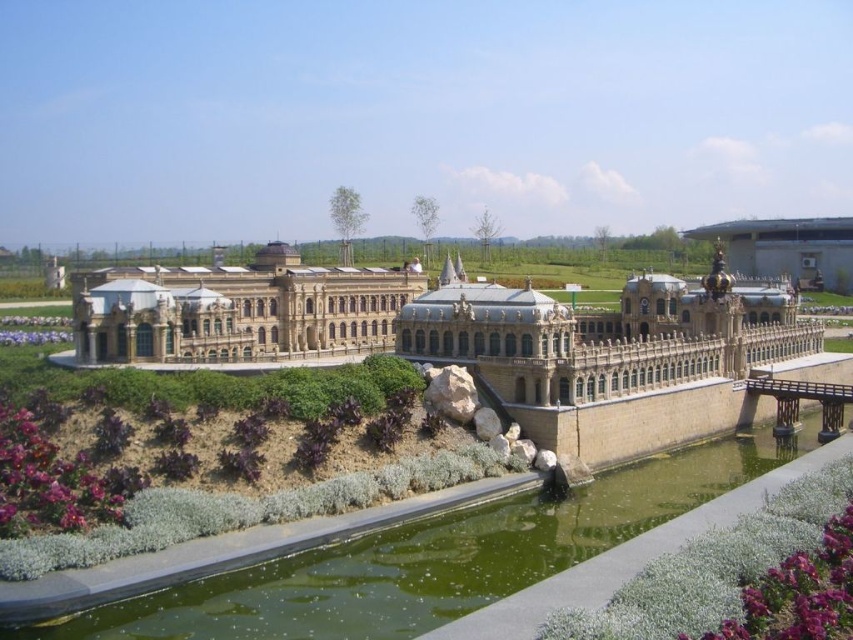
Can you confirm if greenish water at lower center is positioned above golden stone palace at center?

Actually, greenish water at lower center is below golden stone palace at center.

Between point (676, 472) and point (85, 310), which one is positioned in front?

Positioned in front is point (676, 472).

Where is `greenish water at lower center`? The image size is (853, 640). greenish water at lower center is located at coordinates (433, 557).